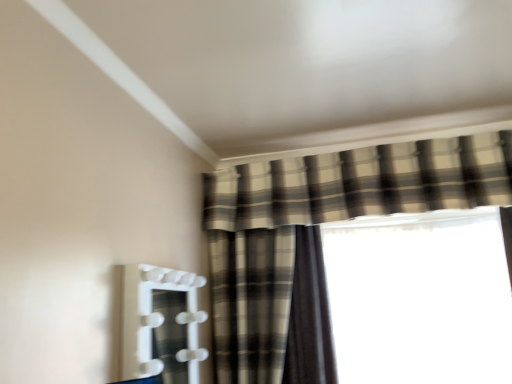
In order to face transparent glass window at center, should I rotate leftwards or rightwards?

Rotate right and turn 21.157 degrees.

The height and width of the screenshot is (384, 512). Describe the element at coordinates (420, 298) in the screenshot. I see `transparent glass window at center` at that location.

Locate an element on the screen. The height and width of the screenshot is (384, 512). transparent glass window at center is located at coordinates (420, 298).

You are a GUI agent. You are given a task and a screenshot of the screen. Output one action in this format:
    pyautogui.click(x=<x>, y=<y>)
    Task: Click on the transparent glass window at center
    The image size is (512, 384).
    Given the screenshot: What is the action you would take?
    pyautogui.click(x=420, y=298)